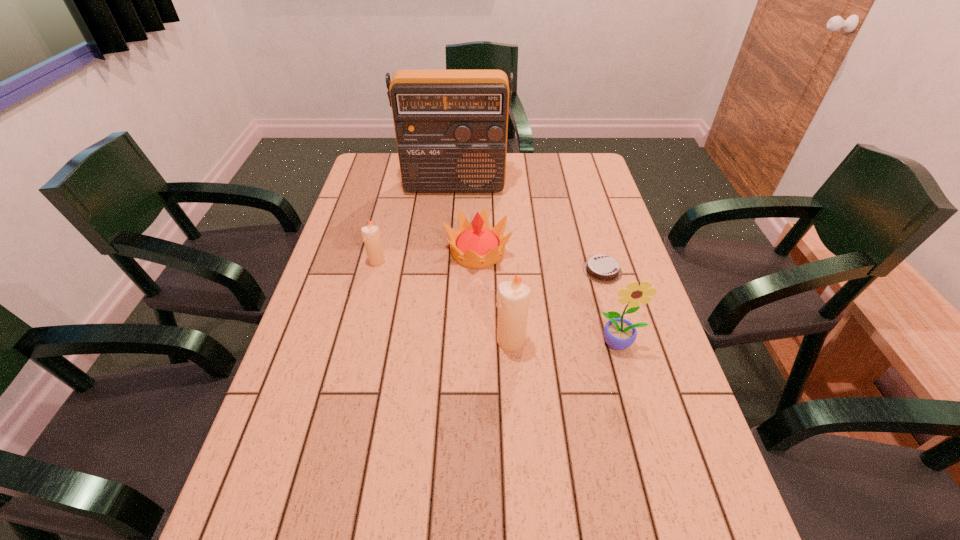
You are a GUI agent. You are given a task and a screenshot of the screen. Output one action in this format:
    pyautogui.click(x=<x>, y=<y>)
    Task: Click on the vacant area between the shortest object and the sunflower
    This screenshot has width=960, height=540.
    Given the screenshot: What is the action you would take?
    pyautogui.click(x=611, y=307)

The height and width of the screenshot is (540, 960). What are the coordinates of `vacant point located between the chocolate cake and the nearer candle` in the screenshot? It's located at (557, 306).

The height and width of the screenshot is (540, 960). I want to click on unoccupied position between the crown and the right candle, so click(x=494, y=296).

Identify the location of free space between the farthest object and the chocolate cake. This screenshot has height=540, width=960. (528, 228).

Point out which object is positioned as the fifth nearest to the crown. Please provide its 2D coordinates. Your answer should be formatted as a tuple, i.e. [(x, y)], where the tuple contains the x and y coordinates of a point satisfying the conditions above.

[(619, 333)]

Identify which object is the third closest to the sunflower. Please provide its 2D coordinates. Your answer should be formatted as a tuple, i.e. [(x, y)], where the tuple contains the x and y coordinates of a point satisfying the conditions above.

[(477, 245)]

Where is `vacant space that satisfies the following two spatial constraints: 1. on the front-facing side of the radio receiver; 2. on the right side of the shortest object`? This screenshot has height=540, width=960. vacant space that satisfies the following two spatial constraints: 1. on the front-facing side of the radio receiver; 2. on the right side of the shortest object is located at coordinates pos(447,271).

Find the location of a particular element. vacant area in the image that satisfies the following two spatial constraints: 1. on the front-facing side of the farthest object; 2. on the left side of the chocolate cake is located at coordinates (447, 271).

Where is `free space that satisfies the following two spatial constraints: 1. on the front-facing side of the chocolate cake; 2. on the right side of the farthest object`? The image size is (960, 540). free space that satisfies the following two spatial constraints: 1. on the front-facing side of the chocolate cake; 2. on the right side of the farthest object is located at coordinates (447, 271).

The image size is (960, 540). Identify the location of free spot that satisfies the following two spatial constraints: 1. on the back side of the farther candle; 2. on the right side of the crown. (379, 252).